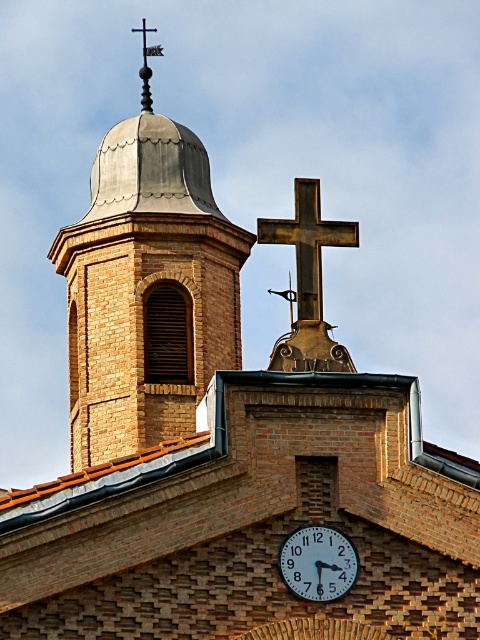
Question: Is the position of gray metallic dome at upper center more distant than that of dark brown wooden cross at center?

Choices:
 (A) no
 (B) yes

Answer: (B)

Question: Which object is positioned closest to the gray metallic dome at upper center?

Choices:
 (A) white glossy clock at center
 (B) dark brown wooden cross at center

Answer: (A)

Question: Can you confirm if dark brown wooden cross at center is smaller than white glossy clock at center?

Choices:
 (A) no
 (B) yes

Answer: (A)

Question: Which point is farther to the camera?

Choices:
 (A) (303, 593)
 (B) (216, 262)

Answer: (B)

Question: Does dark brown wooden cross at center have a larger size compared to white glossy clock at center?

Choices:
 (A) no
 (B) yes

Answer: (B)

Question: Which point is farther from the camera taking this photo?

Choices:
 (A) (278, 548)
 (B) (214, 362)
 (C) (303, 236)

Answer: (B)